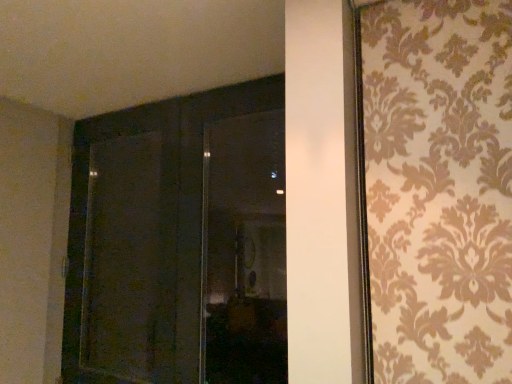
I want to click on dark wood door at center, so click(179, 242).

This screenshot has width=512, height=384. What are the coordinates of `transparent glass window at center` in the screenshot? It's located at (244, 251).

Is the position of transparent glass window at center more distant than that of matte dark wood screen door at left?

No, transparent glass window at center is closer to the camera.

From the image's perspective, which object appears higher, transparent glass window at center or matte dark wood screen door at left?

From the image's view, transparent glass window at center is above.

Is transparent glass window at center wider or thinner than matte dark wood screen door at left?

transparent glass window at center is thinner than matte dark wood screen door at left.

What's the angular difference between transparent glass window at center and matte dark wood screen door at left's facing directions?

3.84 degrees separate the facing orientations of transparent glass window at center and matte dark wood screen door at left.

Is matte dark wood screen door at left at the left side of dark wood door at center?

Yes, matte dark wood screen door at left is to the left of dark wood door at center.

Is matte dark wood screen door at left taller than dark wood door at center?

In fact, matte dark wood screen door at left may be shorter than dark wood door at center.

Can you tell me how much matte dark wood screen door at left and dark wood door at center differ in facing direction?

The angle between the facing direction of matte dark wood screen door at left and the facing direction of dark wood door at center is 0.000987 degrees.

Which is behind, point (188, 105) or point (204, 207)?

The point (188, 105) is behind.

How many degrees apart are the facing directions of dark wood door at center and transparent glass window at center?

The facing directions of dark wood door at center and transparent glass window at center are 3.84 degrees apart.

From the picture: Can we say dark wood door at center lies outside transparent glass window at center?

Indeed, dark wood door at center is completely outside transparent glass window at center.

From the image's perspective, is dark wood door at center above or below transparent glass window at center?

Based on their image positions, dark wood door at center is located beneath transparent glass window at center.

Where is `screen door on the left of transparent glass window at center`? The width and height of the screenshot is (512, 384). screen door on the left of transparent glass window at center is located at coordinates (122, 258).

Which object is closer to the camera taking this photo, matte dark wood screen door at left or transparent glass window at center?

transparent glass window at center is closer to the camera.

Considering the positions of objects matte dark wood screen door at left and transparent glass window at center in the image provided, who is more to the left, matte dark wood screen door at left or transparent glass window at center?

matte dark wood screen door at left.

Does matte dark wood screen door at left have a larger size compared to transparent glass window at center?

Correct, matte dark wood screen door at left is larger in size than transparent glass window at center.

In terms of height, does transparent glass window at center look taller or shorter compared to dark wood door at center?

transparent glass window at center is shorter than dark wood door at center.

From the picture: Which object is positioned more to the right, transparent glass window at center or dark wood door at center?

Positioned to the right is transparent glass window at center.

Between transparent glass window at center and dark wood door at center, which one has smaller size?

transparent glass window at center is smaller.

Between point (238, 175) and point (90, 182), which one is positioned behind?

The point (238, 175) is farther from the camera.

Considering the sizes of objects dark wood door at center and matte dark wood screen door at left in the image provided, who is thinner, dark wood door at center or matte dark wood screen door at left?

dark wood door at center.

Considering the sizes of objects dark wood door at center and matte dark wood screen door at left in the image provided, who is taller, dark wood door at center or matte dark wood screen door at left?

Standing taller between the two is dark wood door at center.

Looking at the image, does dark wood door at center seem bigger or smaller compared to matte dark wood screen door at left?

dark wood door at center is bigger than matte dark wood screen door at left.

At what (x,y) coordinates should I click in order to perform the action: click on screen door that appears on the left of transparent glass window at center. Please return your answer as a coordinate pair (x, y). Image resolution: width=512 pixels, height=384 pixels. Looking at the image, I should click on (122, 258).

Locate an element on the screen. This screenshot has width=512, height=384. screen door that is under the dark wood door at center (from a real-world perspective) is located at coordinates (122, 258).

Estimate the real-world distances between objects in this image. Which object is further from matte dark wood screen door at left, dark wood door at center or transparent glass window at center?

Among the two, transparent glass window at center is located further to matte dark wood screen door at left.

From the image, which object appears to be farther from dark wood door at center, transparent glass window at center or matte dark wood screen door at left?

matte dark wood screen door at left lies further to dark wood door at center than the other object.

Considering their positions, is matte dark wood screen door at left positioned further to dark wood door at center than transparent glass window at center?

matte dark wood screen door at left lies further to dark wood door at center than the other object.

From the image, which object appears to be farther from transparent glass window at center, dark wood door at center or matte dark wood screen door at left?

matte dark wood screen door at left lies further to transparent glass window at center than the other object.

When comparing their distances from matte dark wood screen door at left, does transparent glass window at center or dark wood door at center seem closer?

dark wood door at center is positioned closer to the anchor matte dark wood screen door at left.

Considering their positions, is matte dark wood screen door at left positioned closer to transparent glass window at center than dark wood door at center?

dark wood door at center lies closer to transparent glass window at center than the other object.

This screenshot has width=512, height=384. What are the coordinates of `door located between matte dark wood screen door at left and transparent glass window at center in the left-right direction` in the screenshot? It's located at (179, 242).